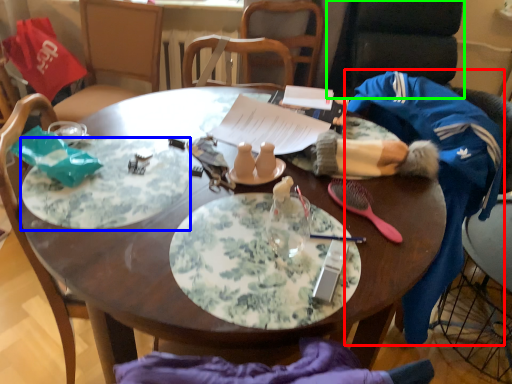
Question: Which object is the closest to the clothing (highlighted by a red box)? Choose among these: platter (highlighted by a blue box) or armchair (highlighted by a green box).

Choices:
 (A) platter
 (B) armchair

Answer: (A)